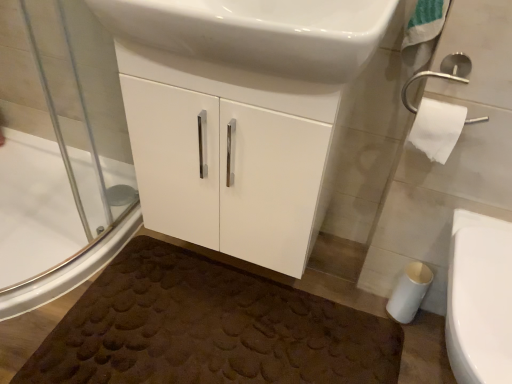
Question: Does white matte toilet paper at lower right, arranged as the 1th toilet paper when ordered from the bottom, have a lesser height compared to white glossy sink at upper center?

Choices:
 (A) yes
 (B) no

Answer: (A)

Question: Considering the relative sizes of white matte toilet paper at lower right, arranged as the 1th toilet paper when ordered from the bottom, and white glossy sink at upper center in the image provided, is white matte toilet paper at lower right, arranged as the 1th toilet paper when ordered from the bottom, wider than white glossy sink at upper center?

Choices:
 (A) no
 (B) yes

Answer: (A)

Question: Is white matte toilet paper at lower right, which is counted as the first toilet paper, starting from the back, positioned far away from white glossy sink at upper center?

Choices:
 (A) yes
 (B) no

Answer: (B)

Question: From a real-world perspective, is white matte toilet paper at lower right, which is counted as the first toilet paper, starting from the back, physically above white glossy sink at upper center?

Choices:
 (A) no
 (B) yes

Answer: (A)

Question: From the image's perspective, is white matte toilet paper at lower right, arranged as the 2th toilet paper when viewed from the front, beneath white glossy sink at upper center?

Choices:
 (A) no
 (B) yes

Answer: (B)

Question: Is white matte toilet paper at lower right, arranged as the 1th toilet paper when ordered from the bottom, to the right of white glossy sink at upper center from the viewer's perspective?

Choices:
 (A) no
 (B) yes

Answer: (B)

Question: Is white glossy bidet at lower right shorter than white glossy cabinet at center?

Choices:
 (A) yes
 (B) no

Answer: (A)

Question: Is white glossy bidet at lower right to the left of white glossy cabinet at center from the viewer's perspective?

Choices:
 (A) yes
 (B) no

Answer: (B)

Question: Is white glossy bidet at lower right at the right side of white glossy cabinet at center?

Choices:
 (A) no
 (B) yes

Answer: (B)

Question: Is white glossy bidet at lower right bigger than white glossy cabinet at center?

Choices:
 (A) no
 (B) yes

Answer: (A)

Question: Can you confirm if white glossy bidet at lower right is wider than white glossy cabinet at center?

Choices:
 (A) no
 (B) yes

Answer: (B)

Question: From a real-world perspective, does white glossy bidet at lower right stand above white glossy cabinet at center?

Choices:
 (A) no
 (B) yes

Answer: (A)

Question: Is white glossy bidet at lower right further to the viewer compared to white glossy sink at upper center?

Choices:
 (A) no
 (B) yes

Answer: (B)